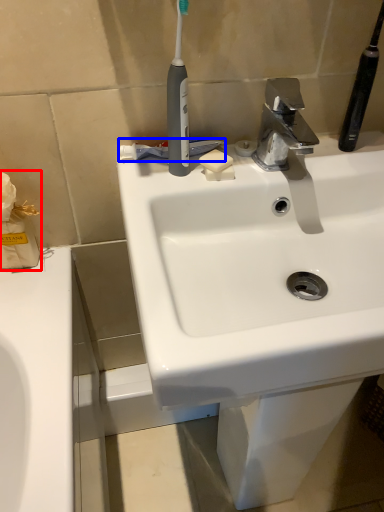
Question: Which point is closer to the camera, tissue (highlighted by a red box) or toothpaste (highlighted by a blue box)?

Choices:
 (A) tissue
 (B) toothpaste

Answer: (A)